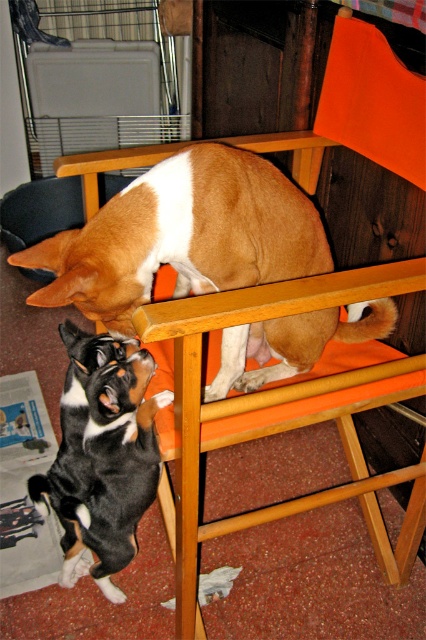
Does brown matte dog at upper center have a greater height compared to orange fabric stool at upper center?

No.

Does brown matte dog at upper center appear on the right side of orange fabric stool at upper center?

In fact, brown matte dog at upper center is to the left of orange fabric stool at upper center.

Does point (256, 154) come in front of point (408, 548)?

Yes, it is in front of point (408, 548).

This screenshot has height=640, width=426. Find the location of `brown matte dog at upper center`. brown matte dog at upper center is located at coordinates (183, 236).

Does orange fabric stool at upper center appear on the right side of black and white fur at lower left?

Correct, you'll find orange fabric stool at upper center to the right of black and white fur at lower left.

Can you confirm if orange fabric stool at upper center is positioned above black and white fur at lower left?

Indeed, orange fabric stool at upper center is positioned over black and white fur at lower left.

Is point (301, 496) farther from camera compared to point (63, 410)?

That is True.

Where is `orange fabric stool at upper center`? orange fabric stool at upper center is located at coordinates (279, 412).

Is brown matte dog at upper center positioned behind black and white fur at lower left?

No, it is in front of black and white fur at lower left.

Which of these two, brown matte dog at upper center or black and white fur at lower left, stands taller?

black and white fur at lower left

Identify the location of brown matte dog at upper center. (183, 236).